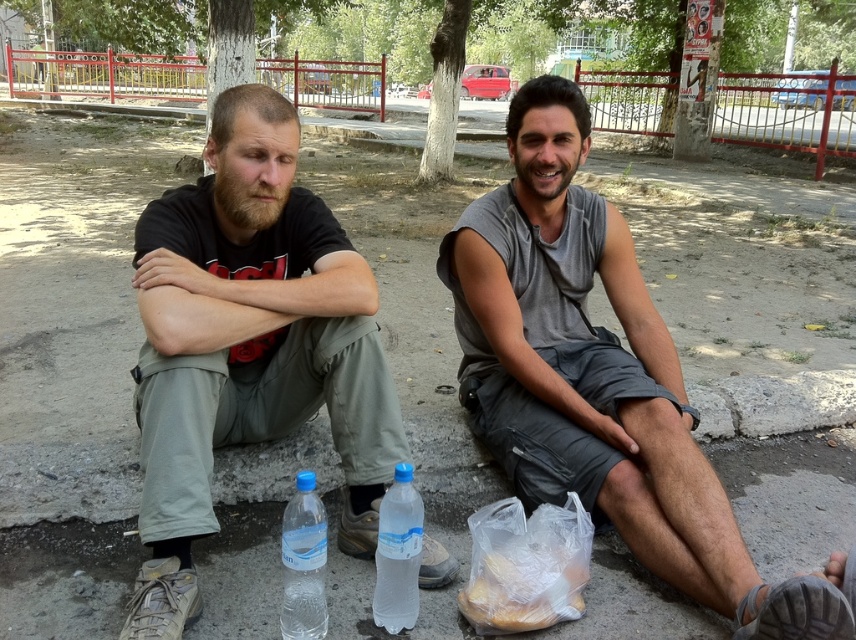
Question: Estimate the real-world distances between objects in this image. Which object is farther from the translucent plastic bag of bread at lower center?

Choices:
 (A) gray fabric sleeve at lower right
 (B) matte black shirt at center
 (C) gray cotton tank top at center
 (D) transparent plastic bottle at center

Answer: (B)

Question: Which point is farther to the camera?

Choices:
 (A) (414, 524)
 (B) (304, 529)
 (C) (577, 600)
 (D) (489, 291)

Answer: (D)

Question: Does gray cotton tank top at center lie in front of translucent plastic bag of bread at lower center?

Choices:
 (A) yes
 (B) no

Answer: (A)

Question: Which of the following is the closest to the observer?

Choices:
 (A) translucent plastic bag of bread at lower center
 (B) transparent plastic bottle at center
 (C) matte black shirt at center

Answer: (C)

Question: Does gray fabric sleeve at lower right come behind translucent plastic bottle at lower center?

Choices:
 (A) yes
 (B) no

Answer: (A)

Question: Can you confirm if gray cotton tank top at center is positioned below translucent plastic bottle at lower center?

Choices:
 (A) no
 (B) yes

Answer: (A)